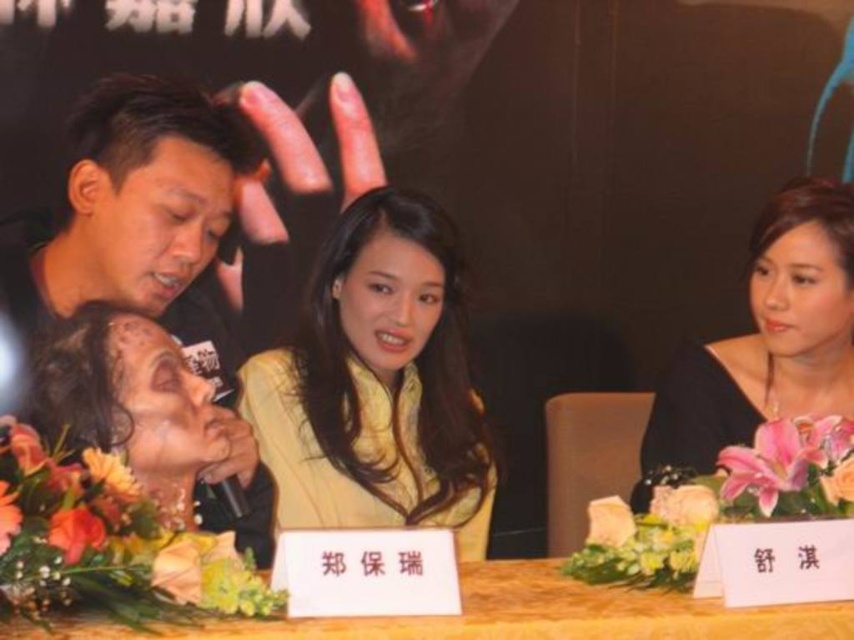
You are attending the event and want to know the spatial relationship between the yellow matte jacket at center and the black silk dress at right. Which one is positioned lower in the image?

The yellow matte jacket at center is positioned below the black silk dress at right, so it is lower in the image.

You are attending a formal event and need to place a nameplate for a guest who should sit to the right of the wooden table at center. Where should you place the nameplate in relation to the yellow matte jacket at center?

The yellow matte jacket at center is to the left of the wooden table at center, so placing the nameplate to the right of the wooden table at center would mean positioning it to the right side of the wooden table at center, which is opposite the yellow matte jacket at center.

You are a photographer at the event and need to capture a clear shot of the yellow matte jacket at center and the wooden table at center. However, you notice that one object might block the view of the other. Which object is more likely to obstruct the other, and why?

The yellow matte jacket at center is taller than the wooden table at center, so it is more likely to obstruct the view of the wooden table at center because its height could block the photographer from seeing the table clearly.